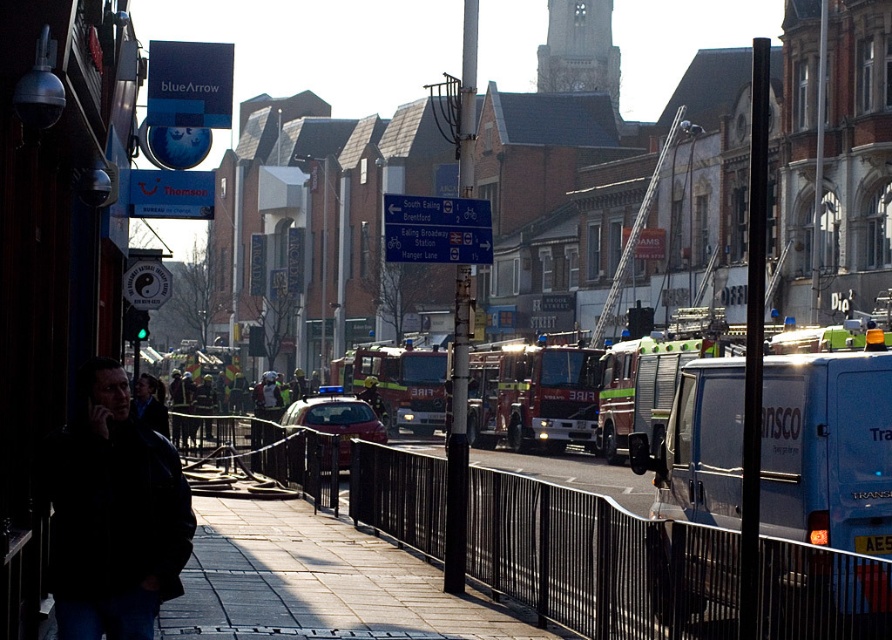
Question: Which point appears farthest from the camera in this image?

Choices:
 (A) (345, 387)
 (B) (742, 410)
 (C) (170, 544)

Answer: (A)

Question: Is blue metallic van at center right further to the viewer compared to dark blue jacket at lower left?

Choices:
 (A) no
 (B) yes

Answer: (B)

Question: Is black leather jacket at left thinner than dark blue jacket at lower left?

Choices:
 (A) no
 (B) yes

Answer: (B)

Question: In this image, where is red metallic fire truck at center located relative to reflective yellow helmet at center?

Choices:
 (A) left
 (B) right

Answer: (B)

Question: Among these objects, which one is nearest to the camera?

Choices:
 (A) red metallic fire truck at center
 (B) dark blue jacket at lower left

Answer: (B)

Question: Which object is closer to the camera taking this photo?

Choices:
 (A) red glossy fire truck at center
 (B) red metallic fire truck at center
 (C) reflective yellow helmet at center

Answer: (B)